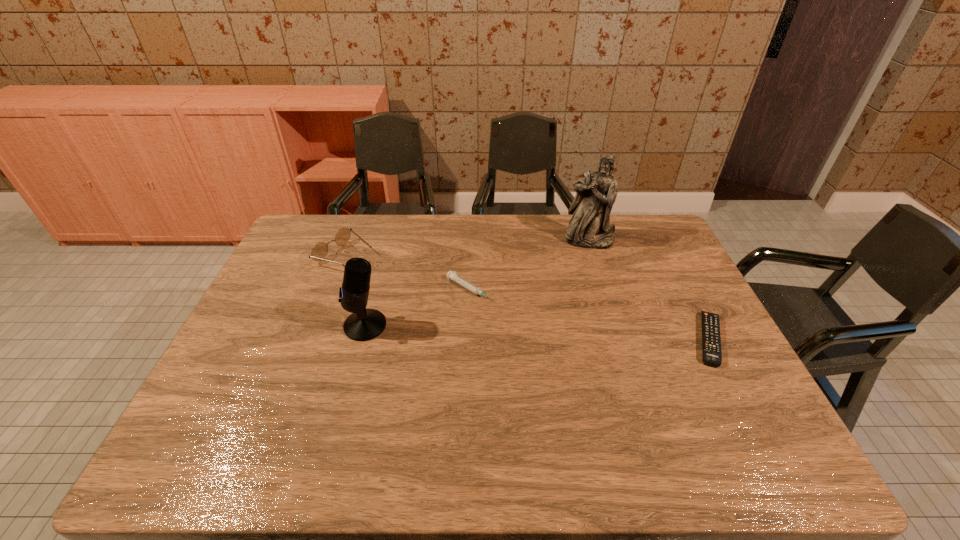
This screenshot has width=960, height=540. I want to click on vacant space located on the stand of the second tallest object, so click(280, 326).

Identify the location of vacant space located on the back of the remote control. tap(678, 277).

Locate an element on the screen. The width and height of the screenshot is (960, 540). vacant space located 0.200m on the front-facing side of the spectacles is located at coordinates (413, 289).

What are the coordinates of `vacant area situated on the front-facing side of the spectacles` in the screenshot? It's located at (396, 281).

The width and height of the screenshot is (960, 540). Identify the location of free space located on the front-facing side of the spectacles. (416, 291).

Find the location of a particular element. This screenshot has width=960, height=540. vacant space located at the needle end of the third object from right to left is located at coordinates (526, 322).

Locate an element on the screen. The width and height of the screenshot is (960, 540). vacant space located 0.390m at the needle end of the third object from right to left is located at coordinates (605, 369).

Identify the location of blank space located at the needle end of the third object from right to left. (565, 346).

Image resolution: width=960 pixels, height=540 pixels. What are the coordinates of `vacant space located 0.170m on the front-facing side of the figurine` in the screenshot? It's located at (584, 282).

Identify the location of free region located on the front-facing side of the figurine. This screenshot has width=960, height=540. (586, 264).